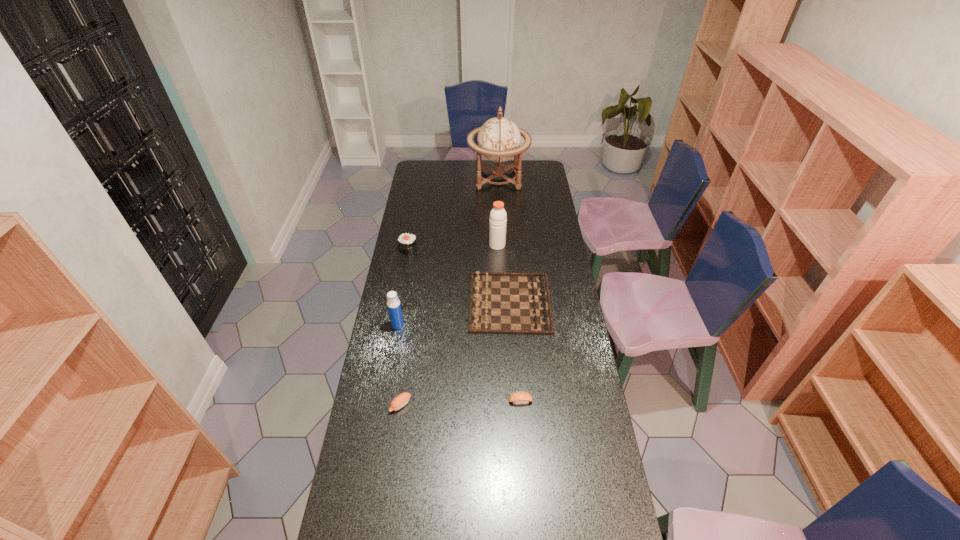
Where is `free space between the shortest sushi and the second tallest sushi`? This screenshot has width=960, height=540. free space between the shortest sushi and the second tallest sushi is located at coordinates (461, 403).

The image size is (960, 540). Identify the location of empty space that is in between the tallest sushi and the shaker. (453, 247).

Identify the location of free spot between the shaker and the third tallest object. The image size is (960, 540). (447, 285).

The image size is (960, 540). Find the location of `vacant area that lies between the farthest sushi and the tallest object`. vacant area that lies between the farthest sushi and the tallest object is located at coordinates (453, 214).

The height and width of the screenshot is (540, 960). Find the location of `free spot between the tallest sushi and the chessboard`. free spot between the tallest sushi and the chessboard is located at coordinates (459, 276).

In order to click on object that stands as the second closest to the second shortest sushi in this screenshot , I will do `click(500, 303)`.

In order to click on object that stands as the fourth closest to the tallest object in this screenshot , I will do `click(393, 303)`.

Locate which sushi ranks second in proximity to the second tallest object. Please provide its 2D coordinates. Your answer should be formatted as a tuple, i.e. [(x, y)], where the tuple contains the x and y coordinates of a point satisfying the conditions above.

[(521, 397)]

The width and height of the screenshot is (960, 540). I want to click on sushi that is the closest to the globe, so click(407, 242).

You are a GUI agent. You are given a task and a screenshot of the screen. Output one action in this format:
    pyautogui.click(x=<x>, y=<y>)
    Task: Click on the free point that satisfies the following two spatial constraints: 1. at the front of the rightmost sushi showing Africa; 2. on the left side of the farthest object
    
    Given the screenshot: What is the action you would take?
    pyautogui.click(x=510, y=401)